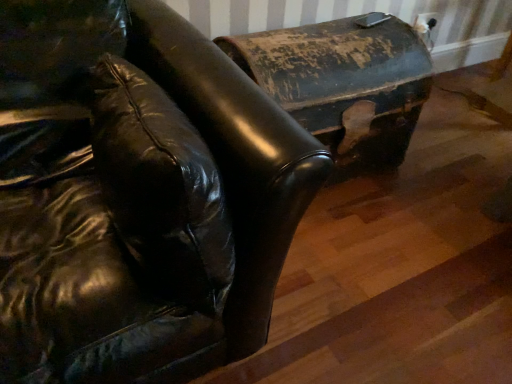
Question: Would you say rusty metal trunk at upper right, arranged as the second furniture when viewed from the left, is inside or outside shiny black leather couch at center, which is the second furniture from right to left?

Choices:
 (A) outside
 (B) inside

Answer: (A)

Question: From a real-world perspective, is rusty metal trunk at upper right, acting as the 1th furniture starting from the right, positioned above or below shiny black leather couch at center, marked as the 1th furniture in a left-to-right arrangement?

Choices:
 (A) below
 (B) above

Answer: (A)

Question: Looking at their shapes, would you say rusty metal trunk at upper right, arranged as the second furniture when viewed from the left, is wider or thinner than shiny black leather couch at center, which is the second furniture from right to left?

Choices:
 (A) thin
 (B) wide

Answer: (A)

Question: Is shiny black leather couch at center, which is the second furniture from right to left, bigger or smaller than rusty metal trunk at upper right, arranged as the second furniture when viewed from the left?

Choices:
 (A) big
 (B) small

Answer: (A)

Question: Relative to rusty metal trunk at upper right, acting as the 1th furniture starting from the right, is shiny black leather couch at center, marked as the 1th furniture in a left-to-right arrangement, in front or behind?

Choices:
 (A) behind
 (B) front

Answer: (B)

Question: From the image's perspective, relative to rusty metal trunk at upper right, acting as the 1th furniture starting from the right, is shiny black leather couch at center, which is the second furniture from right to left, above or below?

Choices:
 (A) above
 (B) below

Answer: (B)

Question: Is shiny black leather couch at center, which is the second furniture from right to left, taller or shorter than rusty metal trunk at upper right, acting as the 1th furniture starting from the right?

Choices:
 (A) tall
 (B) short

Answer: (A)